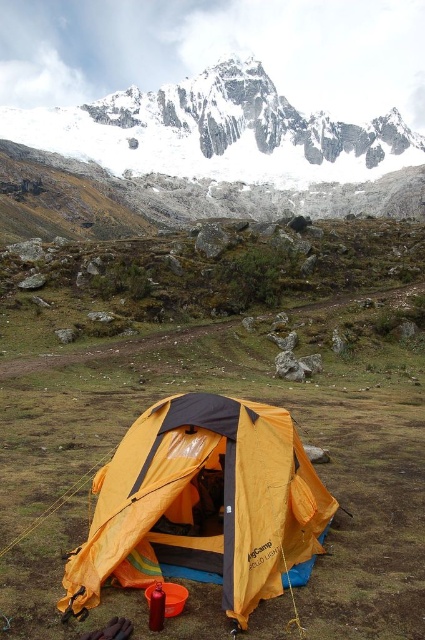
Question: Which of the following is the closest to the observer?

Choices:
 (A) white snow-covered mountain at upper center
 (B) yellow fabric tent at center

Answer: (B)

Question: Is white snow-covered mountain at upper center to the right of yellow fabric tent at center from the viewer's perspective?

Choices:
 (A) no
 (B) yes

Answer: (A)

Question: Can you confirm if white snow-covered mountain at upper center is positioned to the right of yellow fabric tent at center?

Choices:
 (A) no
 (B) yes

Answer: (A)

Question: Is the position of white snow-covered mountain at upper center less distant than that of yellow fabric tent at center?

Choices:
 (A) no
 (B) yes

Answer: (A)

Question: Among these points, which one is nearest to the camera?

Choices:
 (A) (172, 420)
 (B) (359, 180)

Answer: (A)